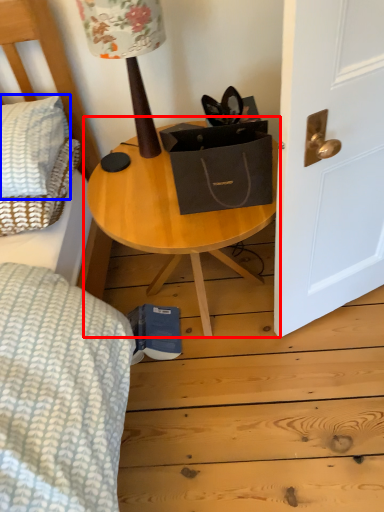
Question: Which object is further to the camera taking this photo, table (highlighted by a red box) or pillow (highlighted by a blue box)?

Choices:
 (A) table
 (B) pillow

Answer: (B)